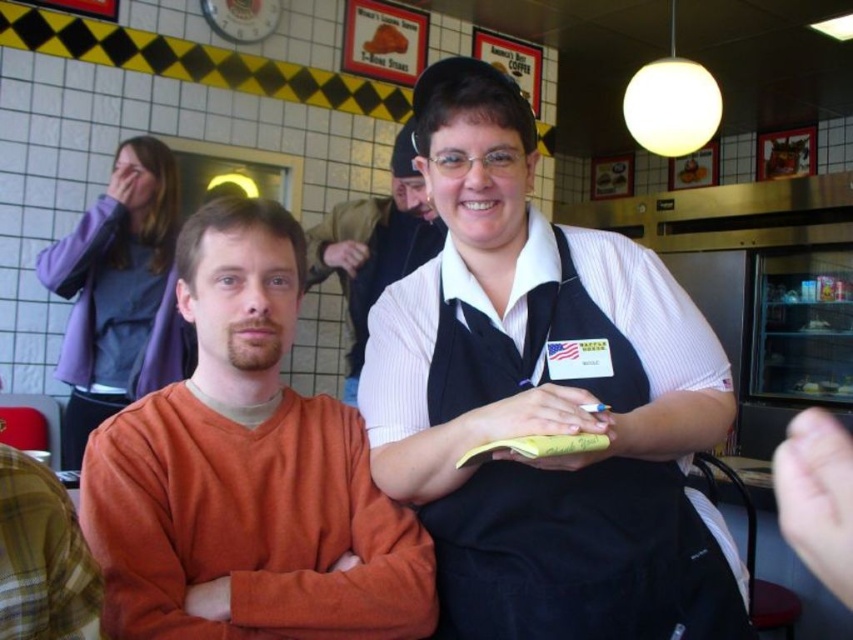
You are a customer in a diner and want to ask the server about the daily specials. The server is standing behind the matte orange shirt at center and the white ribbed sweater at center. Which person should you approach first?

The matte orange shirt at center is in front of the white ribbed sweater at center, so you should approach the matte orange shirt at center first since they are closer to you.